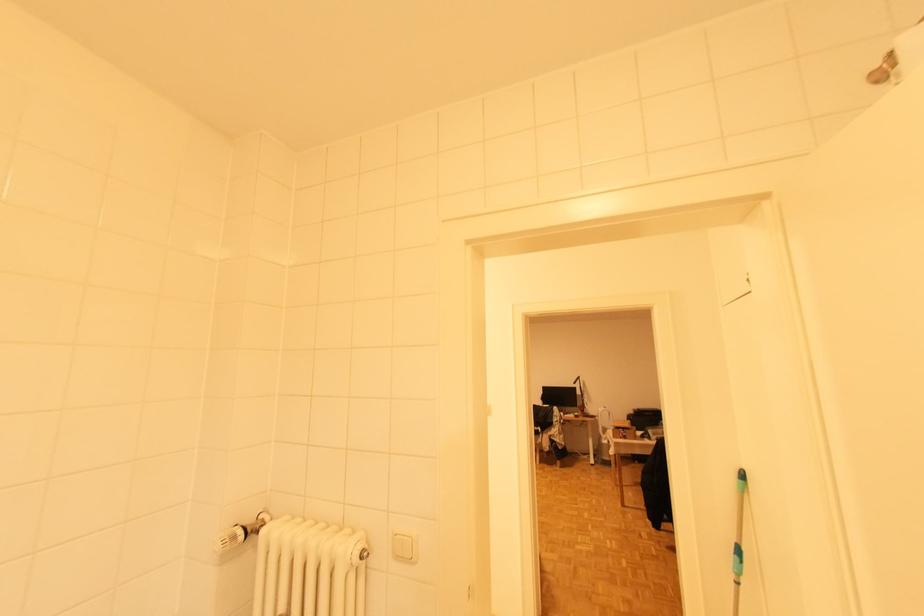
I want to click on radiator knob, so click(359, 553).